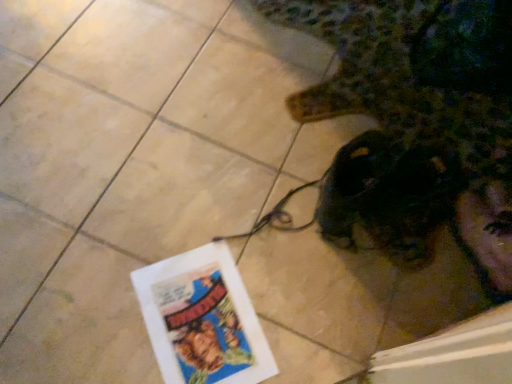
The width and height of the screenshot is (512, 384). I want to click on vacant point to the right of white paper flyer at lower left, so click(x=308, y=319).